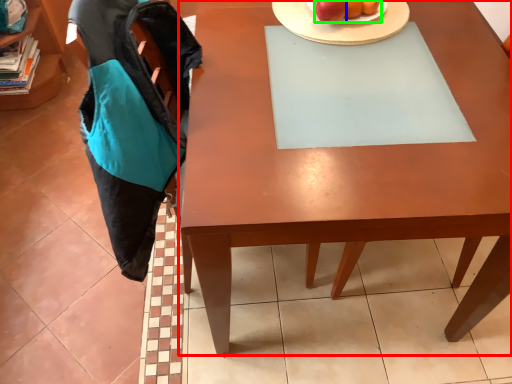
Question: Based on their relative distances, which object is nearer to desk (highlighted by a red box)? Choose from apple (highlighted by a blue box) and fruit (highlighted by a green box).

Choices:
 (A) apple
 (B) fruit

Answer: (B)